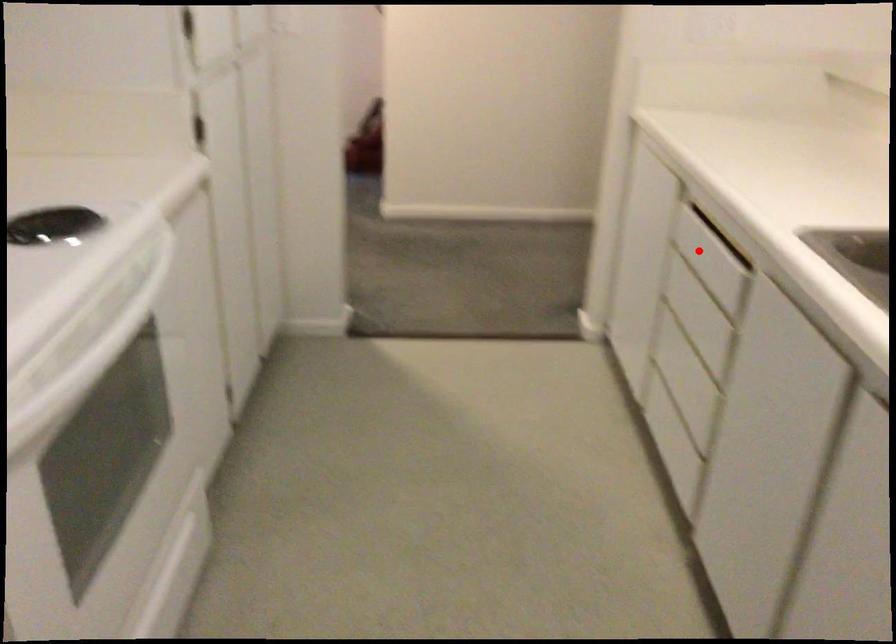
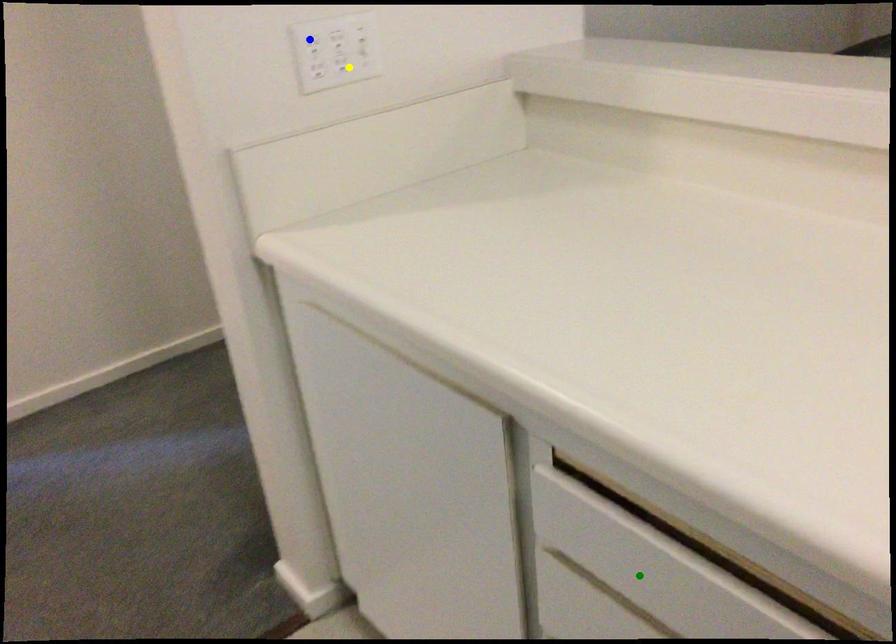
Question: I am providing you with two images of the same scene from different viewpoints. A red point is marked on the first image. You are given multiple points on the second image. Which point in image 2 represents the same 3d spot as the red point in image 1?

Choices:
 (A) yellow point
 (B) blue point
 (C) green point

Answer: (C)